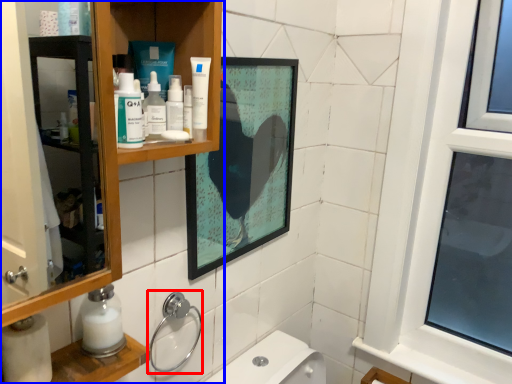
Question: Which object is closer to the camera taking this photo, plumbing fixture (highlighted by a red box) or bathroom cabinet (highlighted by a blue box)?

Choices:
 (A) plumbing fixture
 (B) bathroom cabinet

Answer: (B)